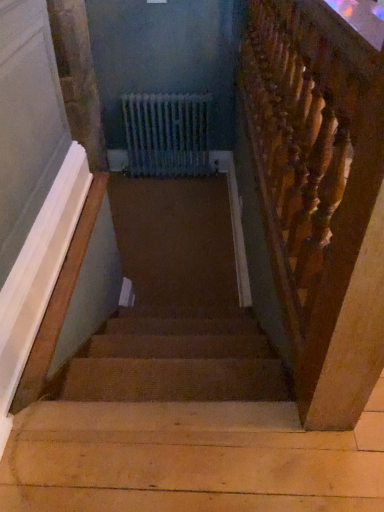
This screenshot has width=384, height=512. Describe the element at coordinates (322, 190) in the screenshot. I see `dark brown wood at right` at that location.

Find the location of a particular element. The height and width of the screenshot is (512, 384). dark brown wood at right is located at coordinates (322, 190).

Locate an element on the screen. dark brown wood at right is located at coordinates (322, 190).